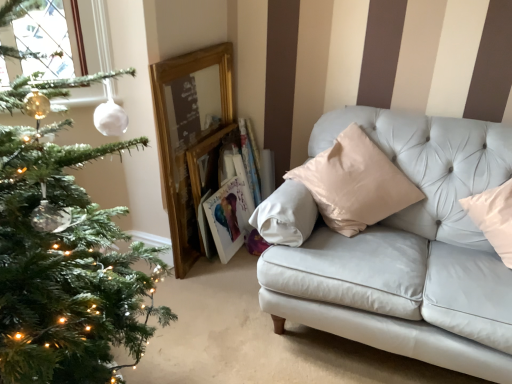
The image size is (512, 384). What do you see at coordinates (228, 218) in the screenshot?
I see `wooden picture frame at center` at bounding box center [228, 218].

Measure the distance between point (221, 243) and camera.

The depth of point (221, 243) is 2.34 meters.

Identify the location of wooden picture frame at center. (228, 218).

What is the approximate width of wooden picture frame at center?

5.06 inches.

Where is `wooden picture frame at center`? This screenshot has height=384, width=512. wooden picture frame at center is located at coordinates (228, 218).